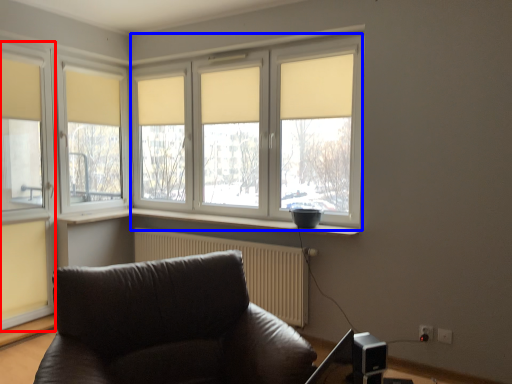
Question: Which object is closer to the camera taking this photo, window (highlighted by a red box) or bay window (highlighted by a blue box)?

Choices:
 (A) window
 (B) bay window

Answer: (B)